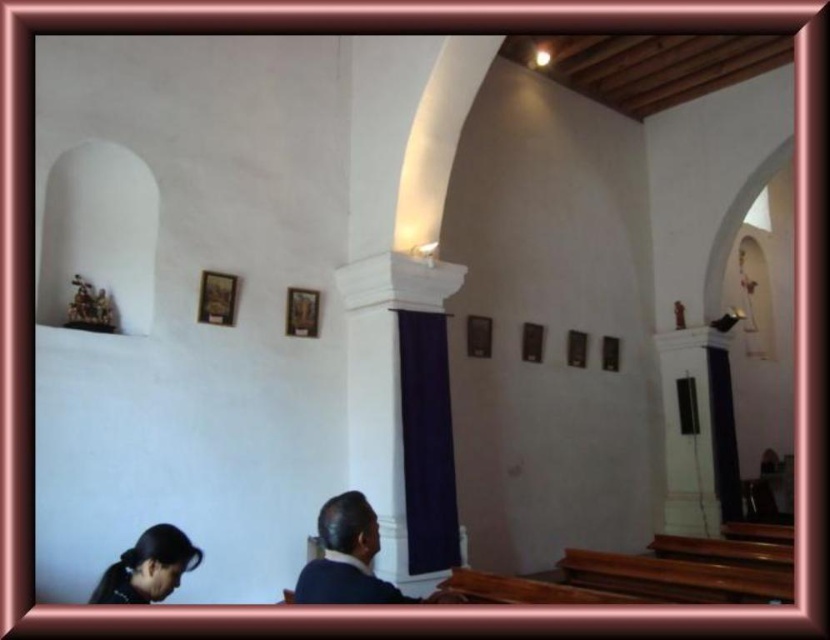
Question: In this image, where is black hair at lower left located relative to matte black frame at center?

Choices:
 (A) above
 (B) below

Answer: (B)

Question: Is black hair at lower left positioned at the back of wooden frame at upper center?

Choices:
 (A) no
 (B) yes

Answer: (A)

Question: Observing the image, what is the correct spatial positioning of wooden frame at upper center in reference to matte black frame at center?

Choices:
 (A) left
 (B) right

Answer: (A)

Question: Based on their relative distances, which object is farther from the dark blue suit at center?

Choices:
 (A) wooden frame at upper center
 (B) matte black frame at center
 (C) wooden frame at center
 (D) black hair at lower left

Answer: (B)

Question: Among these points, which one is farthest from the camera?

Choices:
 (A) (476, 342)
 (B) (130, 592)
 (C) (287, 296)

Answer: (A)

Question: Which object is the closest to the wooden frame at center?

Choices:
 (A) black hair at lower left
 (B) matte black frame at center

Answer: (B)